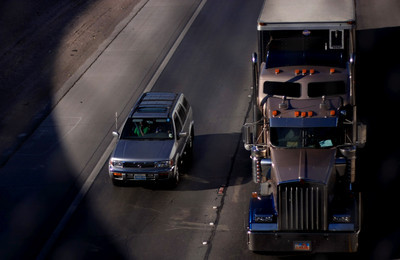
Locate an element on the screen. hood is located at coordinates (150, 151), (306, 172).